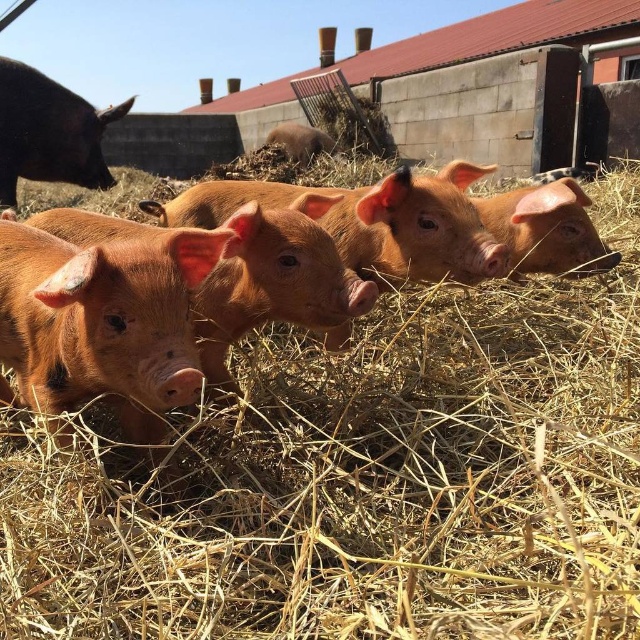
Question: Which of the following is the closest to the observer?

Choices:
 (A) click(x=326, y=150)
 (B) click(x=500, y=193)

Answer: (B)

Question: Considering the relative positions of shiny black pig at upper left and brown matte piglet at center in the image provided, where is shiny black pig at upper left located with respect to brown matte piglet at center?

Choices:
 (A) right
 (B) left

Answer: (B)

Question: Is shiny black pig at upper left closer to camera compared to brown matte piglet at center?

Choices:
 (A) yes
 (B) no

Answer: (A)

Question: Which point is closer to the camera?

Choices:
 (A) shiny black pig at upper left
 (B) smooth brown piglet at center
 (C) brown matte piglet at center

Answer: (B)

Question: Estimate the real-world distances between objects in this image. Which object is farther from the brown matte piglet at center?

Choices:
 (A) smooth brown piglet at center
 (B) shiny black pig at upper left

Answer: (A)

Question: Can you confirm if smooth brown piglet at center is positioned to the left of brown matte piglet at center?

Choices:
 (A) no
 (B) yes

Answer: (A)